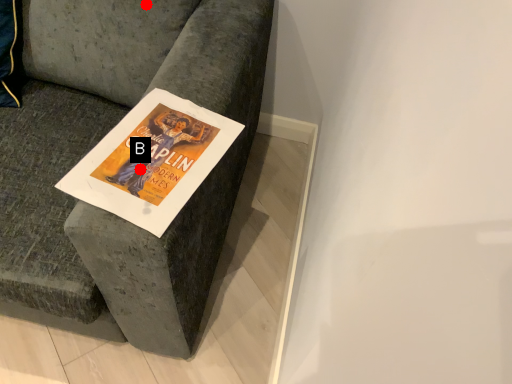
Question: Two points are circled on the image, labeled by A and B beside each circle. Which point is closer to the camera?

Choices:
 (A) A is closer
 (B) B is closer

Answer: (B)